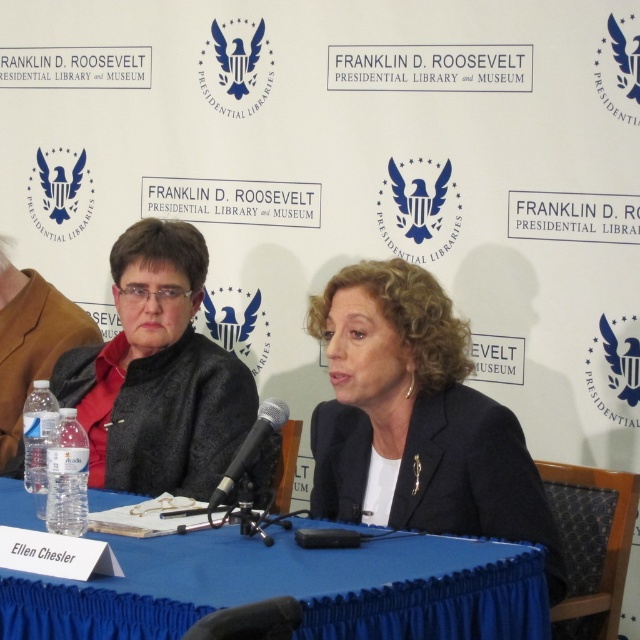
You are attending a press conference at the Franklin D. Roosevelt Presidential Library and Museum. You see a blue fabric table at center and a matte black jacket at left. Which object is closer to the front of the scene?

The blue fabric table at center is positioned under the matte black jacket at left, meaning the table is closer to the front of the scene than the jacket.

You are standing at the center of the image. Which direction should you move to find the matte black jacket at left?

Since the matte black jacket at left is located at point (x=157, y=372) in 2D coordinates, you should move to the left to find it.